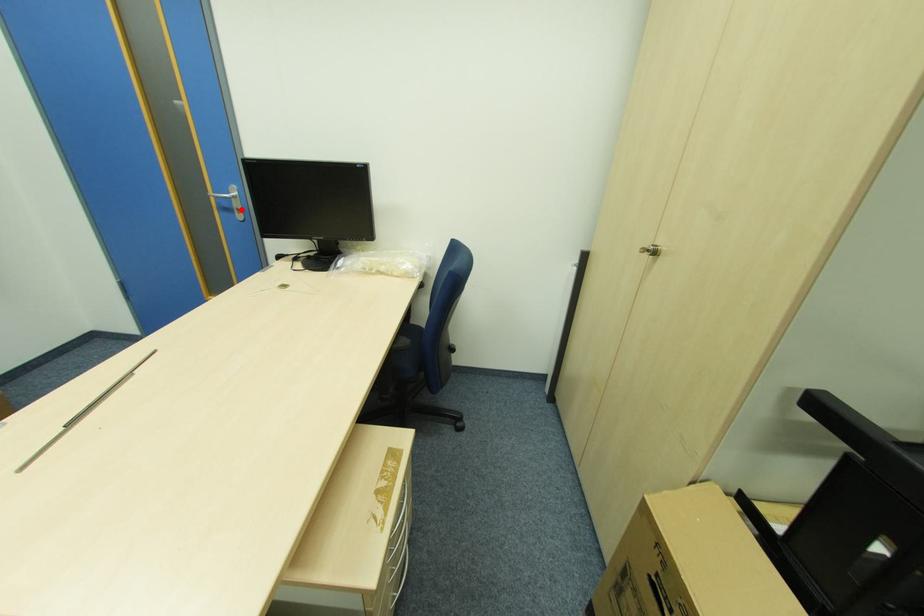
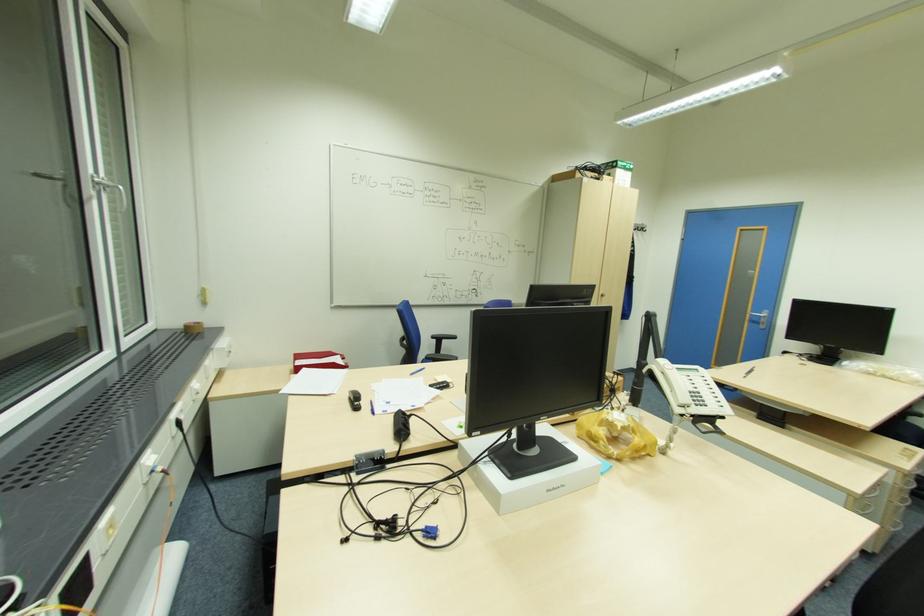
The point at the highlighted location is marked in the first image. Where is the corresponding point in the second image?

(766, 323)